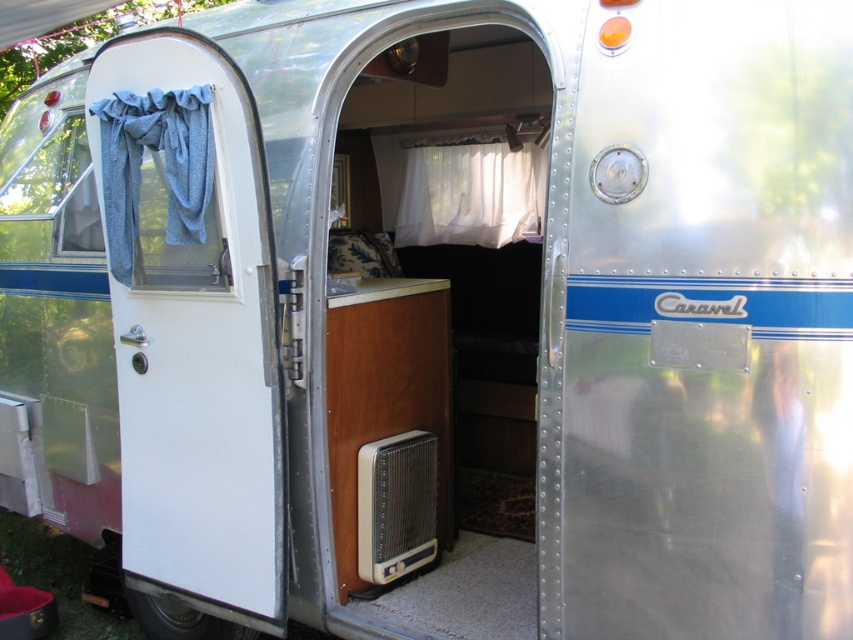
Question: Does white matte door at center have a lesser width compared to white matte door at left?

Choices:
 (A) no
 (B) yes

Answer: (A)

Question: Can you confirm if white matte door at center is bigger than white matte door at left?

Choices:
 (A) yes
 (B) no

Answer: (A)

Question: Which point appears closest to the camera in this image?

Choices:
 (A) (177, 307)
 (B) (187, 445)

Answer: (A)

Question: Among these objects, which one is nearest to the camera?

Choices:
 (A) white matte door at center
 (B) white matte door at left

Answer: (A)

Question: In this image, where is white matte door at center located relative to white matte door at left?

Choices:
 (A) below
 (B) above

Answer: (B)